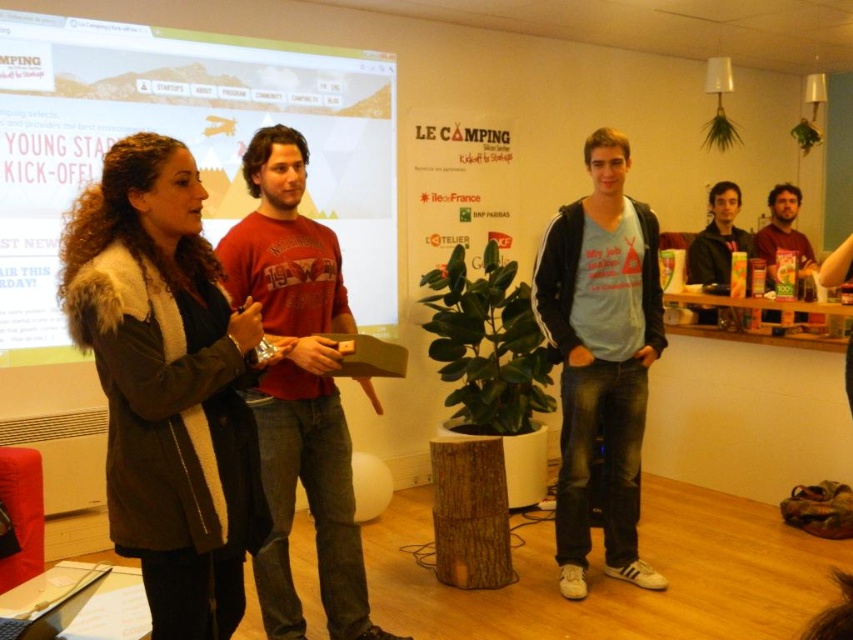
Question: Which point is farther to the camera?

Choices:
 (A) (310, 285)
 (B) (207, 499)
 (C) (724, 225)
 (D) (242, 195)

Answer: (C)

Question: Does matte white poster at upper left lie behind matte brown shirt at right?

Choices:
 (A) no
 (B) yes

Answer: (A)

Question: Among these points, which one is farthest from the camera?

Choices:
 (A) (316, 52)
 (B) (792, 193)
 (C) (230, 413)

Answer: (B)

Question: Is matte black jacket at right below matte brown shirt at right?

Choices:
 (A) yes
 (B) no

Answer: (B)

Question: Is the position of brown fur coat at center more distant than that of matte red t-shirt at center?

Choices:
 (A) yes
 (B) no

Answer: (B)

Question: Which of the following is the closest to the observer?

Choices:
 (A) matte brown shirt at right
 (B) matte black jacket at right

Answer: (A)